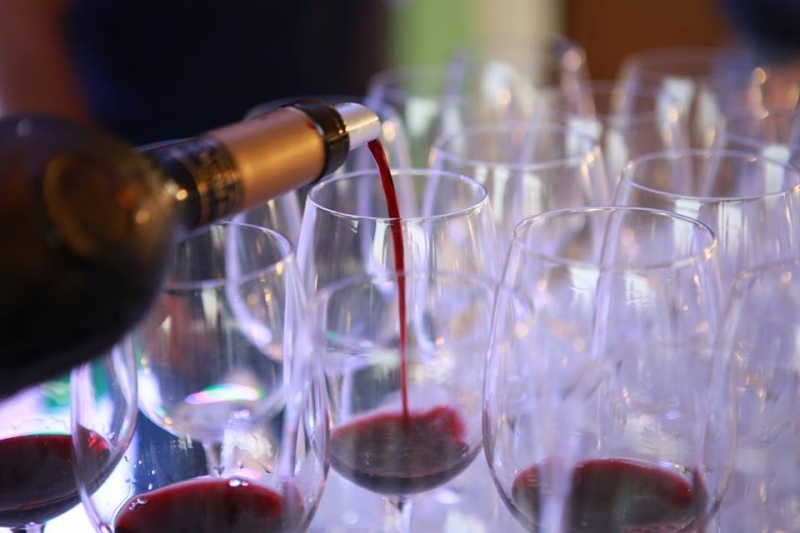
I want to click on wine in a glass, so click(x=22, y=477), click(x=244, y=500), click(x=394, y=445), click(x=621, y=488).